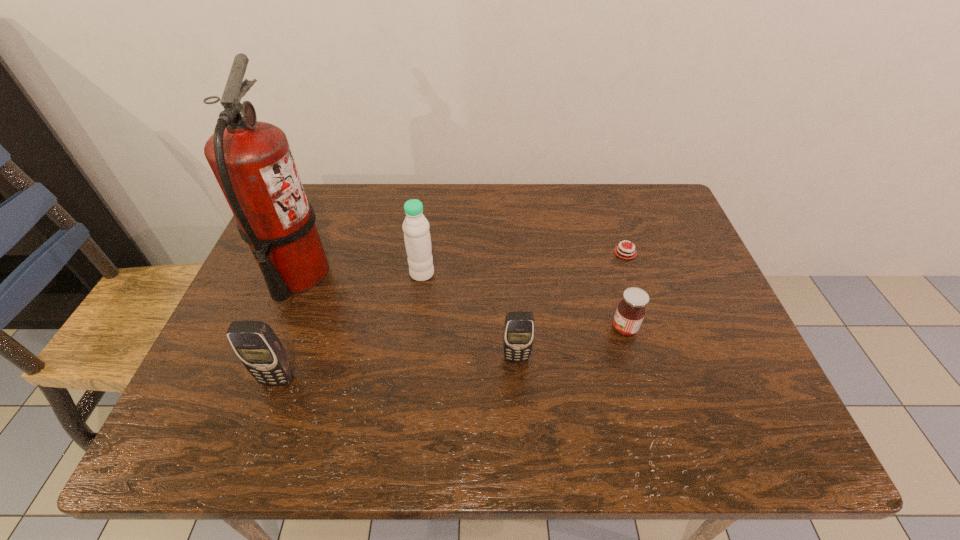
Where is `free space located on the front face of the third object from right to left`? The height and width of the screenshot is (540, 960). free space located on the front face of the third object from right to left is located at coordinates (518, 397).

Find the location of `vacant area situated on the right of the water bottle`. vacant area situated on the right of the water bottle is located at coordinates (557, 274).

Find the location of a particular element. The height and width of the screenshot is (540, 960). free space located 0.090m toward the nozzle of the fire extinguisher is located at coordinates (365, 274).

Find the location of a particular element. vacant area located 0.300m on the left of the shortest object is located at coordinates (487, 252).

I want to click on vacant area located on the label side of the third nearest object, so click(x=512, y=328).

Find the location of `free space located 0.130m on the label side of the third nearest object`. free space located 0.130m on the label side of the third nearest object is located at coordinates (555, 328).

At what (x,y) coordinates should I click in order to perform the action: click on vacant region located 0.180m on the label side of the third nearest object. Please return your answer as a coordinate pair (x, y). This screenshot has height=540, width=960. Looking at the image, I should click on (534, 328).

Find the location of a particular element. Image resolution: width=960 pixels, height=540 pixels. object located in the near edge section of the desktop is located at coordinates (260, 350).

Locate an element on the screen. Image resolution: width=960 pixels, height=540 pixels. cellular telephone located at the left edge is located at coordinates (260, 350).

Where is `fire extinguisher that is at the left edge`? fire extinguisher that is at the left edge is located at coordinates (252, 161).